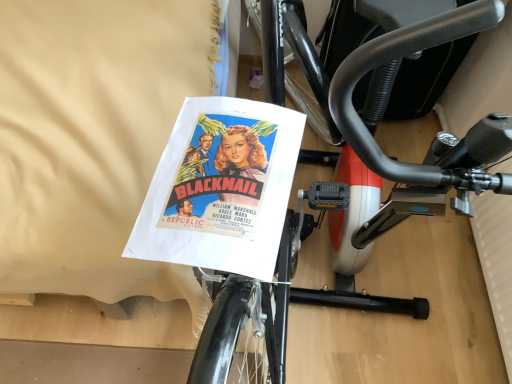
Question: Considering their positions, is black matte exercise bike at center located in front of or behind white paper at upper left?

Choices:
 (A) behind
 (B) front

Answer: (B)

Question: From a real-world perspective, is black matte exercise bike at center physically located above or below white paper at upper left?

Choices:
 (A) above
 (B) below

Answer: (A)

Question: Which is correct: black matte exercise bike at center is inside white paper at upper left, or outside of it?

Choices:
 (A) outside
 (B) inside

Answer: (A)

Question: Looking at the image, does white paper at upper left seem bigger or smaller compared to black matte exercise bike at center?

Choices:
 (A) small
 (B) big

Answer: (B)

Question: From the image's perspective, is white paper at upper left positioned above or below black matte exercise bike at center?

Choices:
 (A) below
 (B) above

Answer: (B)

Question: Is white paper at upper left taller or shorter than black matte exercise bike at center?

Choices:
 (A) tall
 (B) short

Answer: (B)

Question: From a real-world perspective, is white paper at upper left positioned above or below black matte exercise bike at center?

Choices:
 (A) below
 (B) above

Answer: (A)